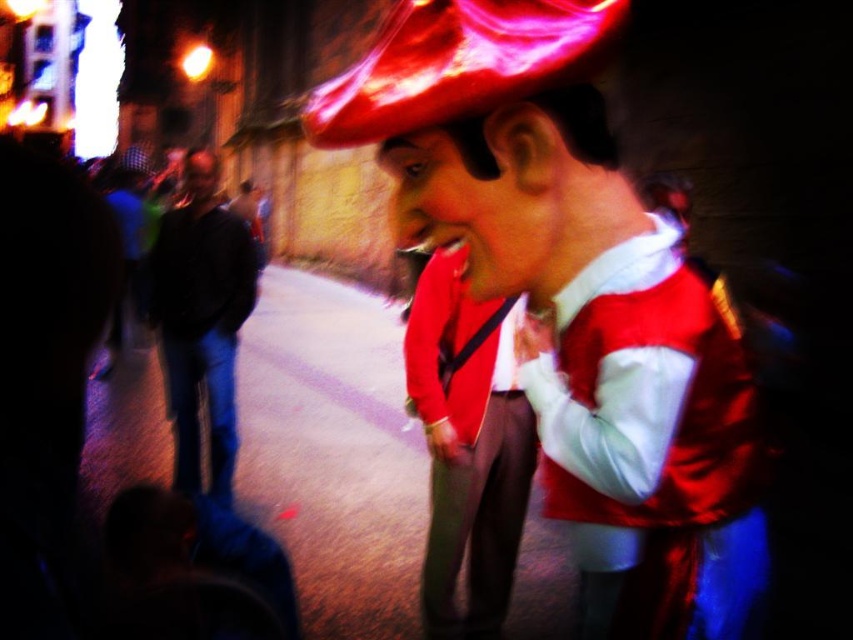
Consider the image. Can you confirm if shiny satin vest at center is shorter than shiny red jacket at center?

Yes.

Does point (619, 490) come behind point (518, 304)?

No, (619, 490) is in front of (518, 304).

Describe the element at coordinates (651, 445) in the screenshot. Image resolution: width=853 pixels, height=640 pixels. I see `shiny satin vest at center` at that location.

Where is `shiny satin vest at center`? shiny satin vest at center is located at coordinates (651, 445).

Does point (646, 237) come in front of point (256, 260)?

Yes, point (646, 237) is in front of point (256, 260).

Between point (642, 541) and point (178, 364), which one is positioned in front?

Point (642, 541)

What are the coordinates of `shiny satin vest at center` in the screenshot? It's located at (651, 445).

Who is more forward, (514, 531) or (207, 262)?

Point (514, 531)

Find the location of a particular element. This screenshot has width=853, height=640. shiny red jacket at center is located at coordinates (468, 444).

Identify the location of shiny red jacket at center. This screenshot has height=640, width=853. (468, 444).